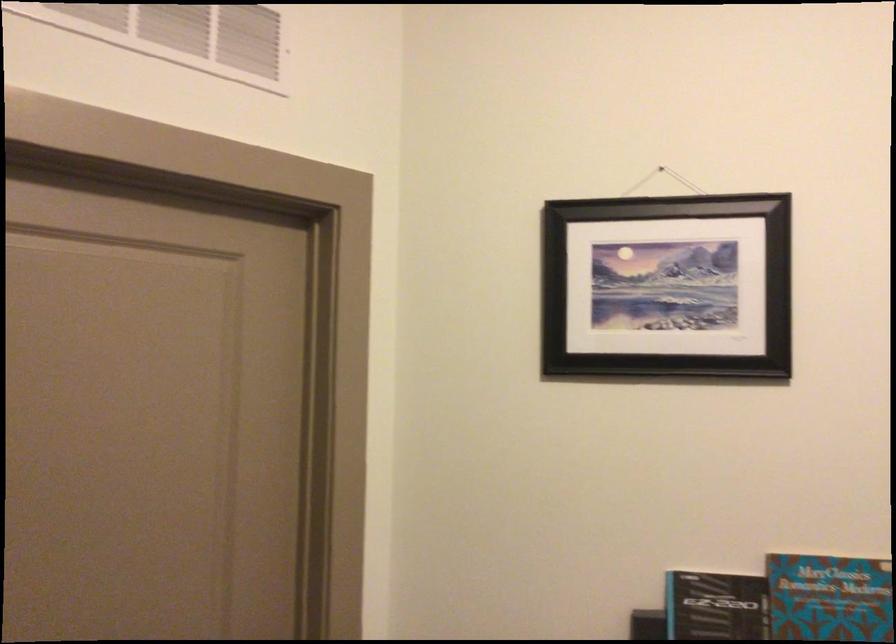
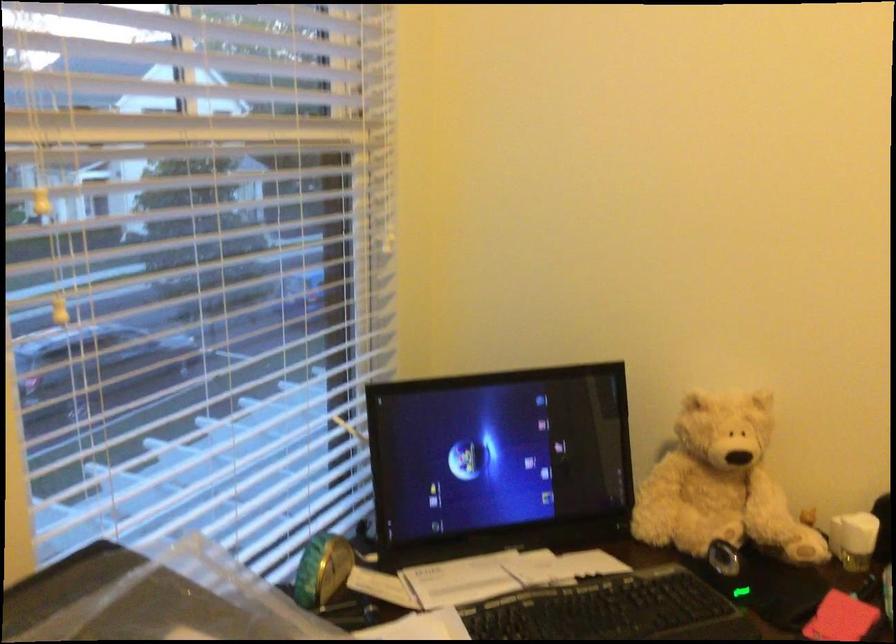
First-person continuous shooting, in which direction is the camera rotating?

The camera's rotation is toward right-down.